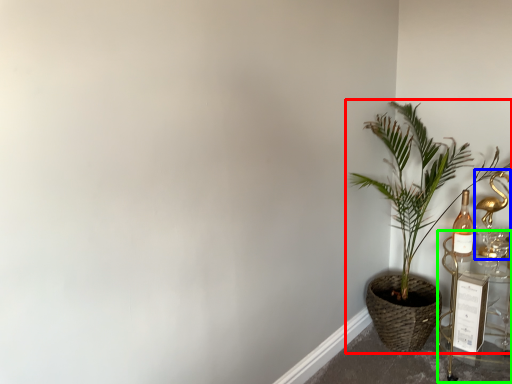
Question: Based on their relative distances, which object is nearer to houseplant (highlighted by a red box)? Choose from candle holder (highlighted by a blue box) and table (highlighted by a green box).

Choices:
 (A) candle holder
 (B) table

Answer: (B)